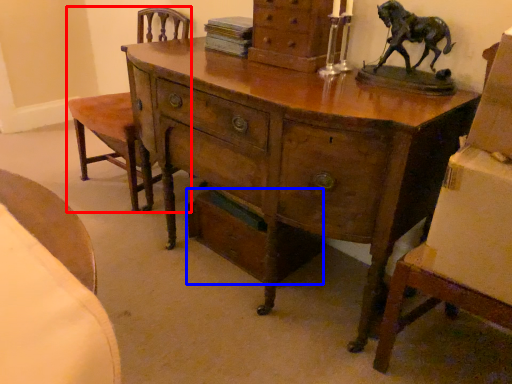
Question: Among these objects, which one is nearest to the camera, armchair (highlighted by a red box) or drawer (highlighted by a blue box)?

Choices:
 (A) armchair
 (B) drawer

Answer: (B)